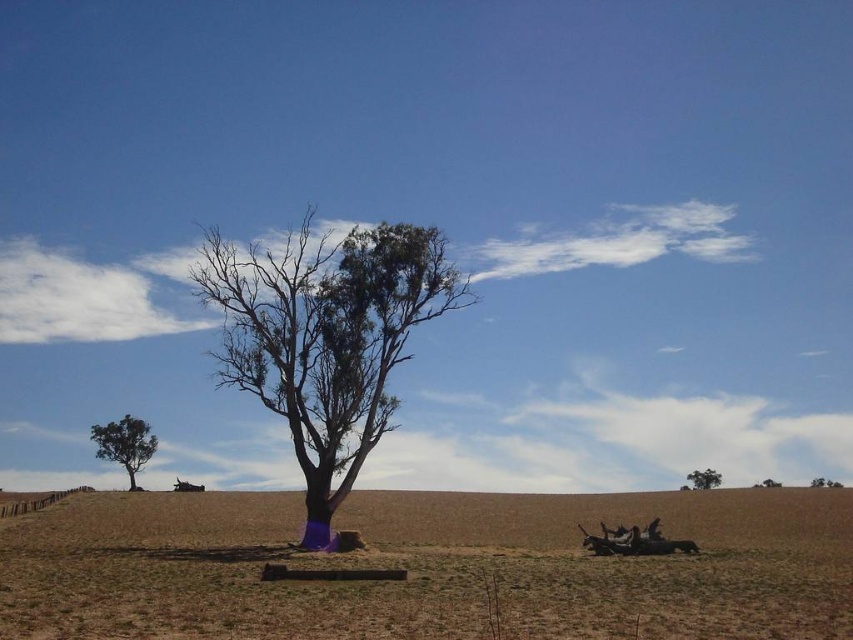
You are standing at the center of the dry grassy field and want to walk towards the green leafy tree at upper right. Which direction should you head?

The green leafy tree at upper right is located at coordinates (704, 477), so you should head towards the upper right direction from your current position in the center of the dry grassy field.

You are a gardener who wants to plant a new tree in the field. The new tree requires a minimum of 100 feet of space between it and any existing trees to thrive. Given the distance between the brown dry grass at center and the green leafy tree at lower left, is this location suitable for planting the new tree?

The brown dry grass at center and green leafy tree at lower left are 102.05 feet apart, which exceeds the required 100 feet of space. Therefore, this location is suitable for planting the new tree.

You are standing in the rural landscape and want to walk from the green leafy tree at lower left to the brown dry grass at center. Which direction should you move?

To move from the green leafy tree at lower left to the brown dry grass at center, you should move to the right since the brown dry grass at center is positioned on the right side of the green leafy tree at lower left.